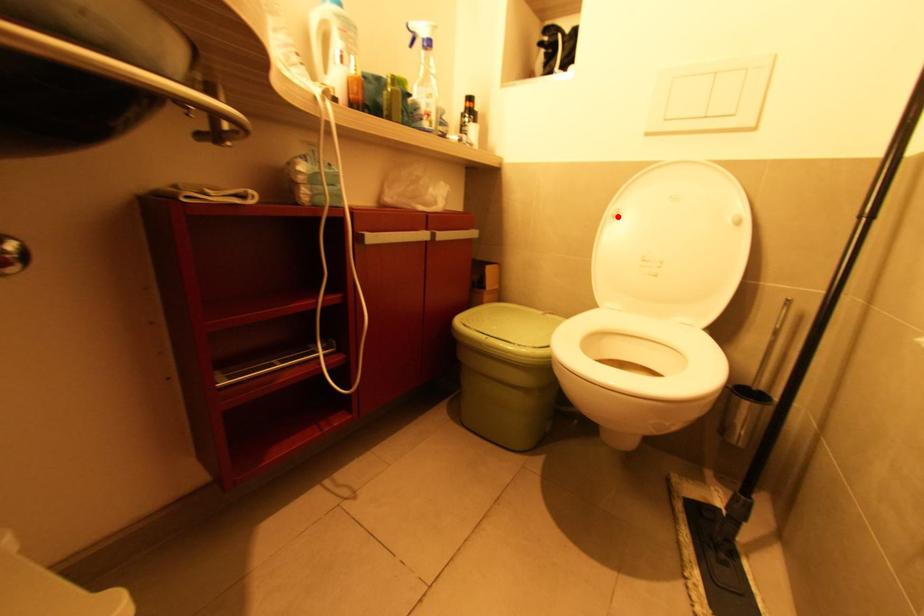
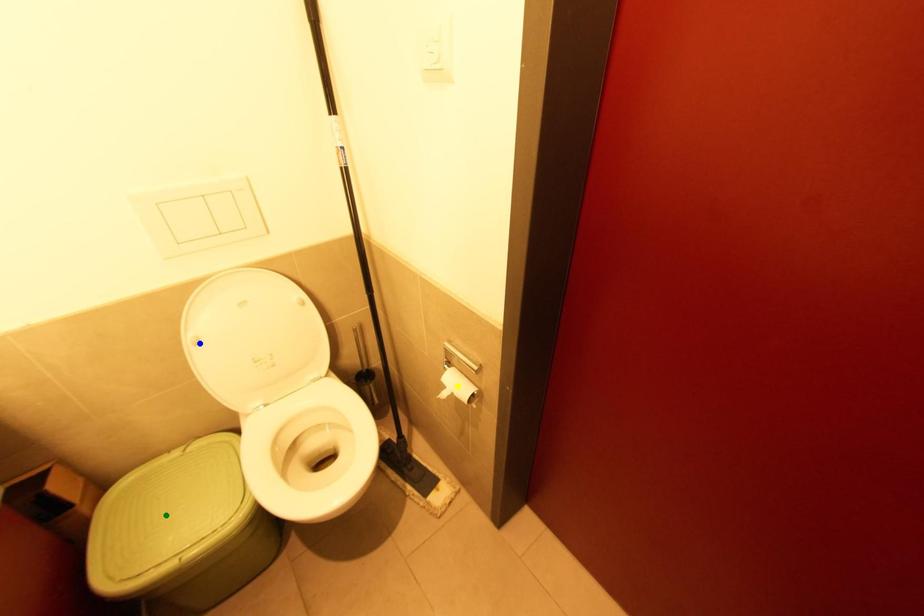
Question: I am providing you with two images of the same scene from different viewpoints. A red point is marked on the first image. You are given multiple points on the second image. Which mark in image 2 goes with the point in image 1?

Choices:
 (A) yellow point
 (B) blue point
 (C) green point

Answer: (B)